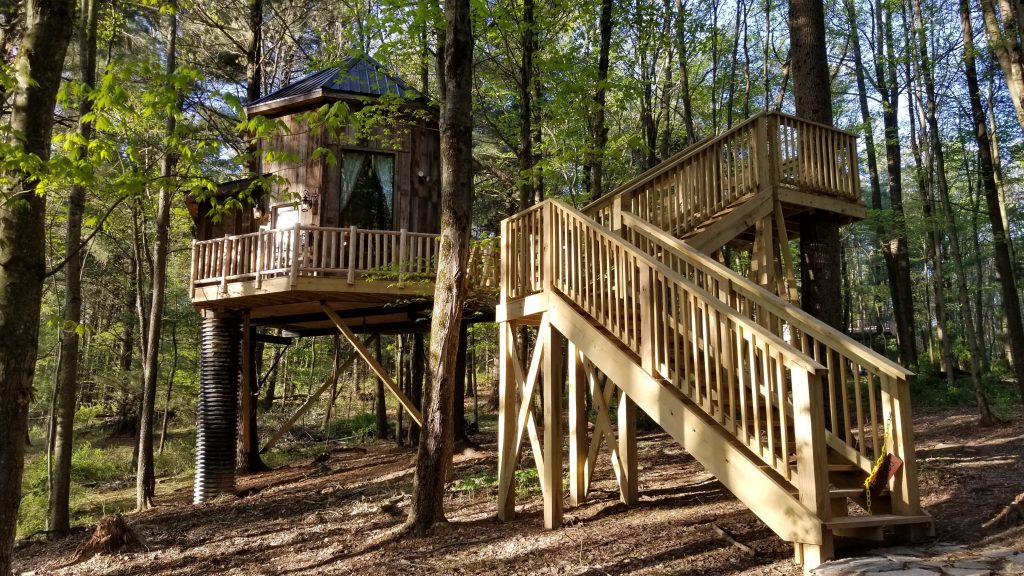
Image resolution: width=1024 pixels, height=576 pixels. Identify the location of curtain. (348, 166), (386, 170).